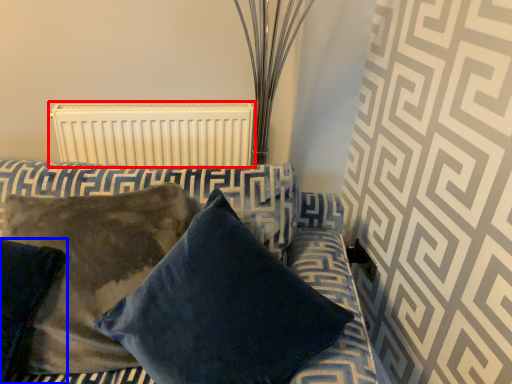
Question: Among these objects, which one is nearest to the camera, radiator (highlighted by a red box) or pillow (highlighted by a blue box)?

Choices:
 (A) radiator
 (B) pillow

Answer: (B)